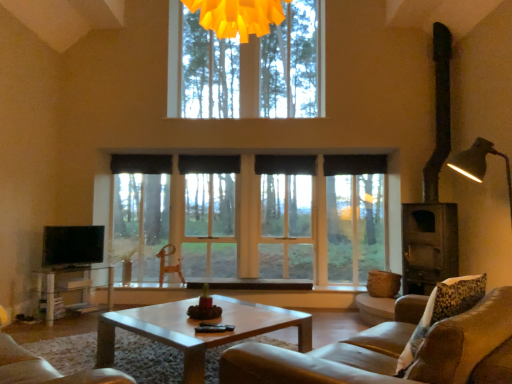
In order to face clear glass window at center, should I rotate leftwards or rightwards?

Turn left approximately 1.294 degrees to face it.

What do you see at coordinates (209, 164) in the screenshot? This screenshot has width=512, height=384. I see `black fabric curtain at center, arranged as the 3th curtain when viewed from the right` at bounding box center [209, 164].

The height and width of the screenshot is (384, 512). Describe the element at coordinates (285, 164) in the screenshot. I see `black fabric curtain at center, the third curtain positioned from the left` at that location.

The image size is (512, 384). Identify the location of dark brown wood stove at right. (433, 194).

I want to click on wooden armchair at center, so click(168, 265).

From the image's perspective, is brown leather couch at center under black fabric curtain at center, the 4th curtain in the left-to-right sequence?

Indeed, from the image's perspective, brown leather couch at center is shown beneath black fabric curtain at center, the 4th curtain in the left-to-right sequence.

Consider the image. Is brown leather couch at center inside or outside of black fabric curtain at center, which is the 1th curtain from right to left?

The correct answer is: outside.

At what (x,y) coordinates should I click in order to perform the action: click on curtain that is the 1st one when counting upward from the brown leather couch at center (from the image's perspective). Please return your answer as a coordinate pair (x, y). The image size is (512, 384). Looking at the image, I should click on (354, 164).

Considering the relative positions of black fabric curtain at center, positioned as the fourth curtain in right-to-left order, and dark brown wood stove at right in the image provided, is black fabric curtain at center, positioned as the fourth curtain in right-to-left order, to the right of dark brown wood stove at right from the viewer's perspective?

Incorrect, black fabric curtain at center, positioned as the fourth curtain in right-to-left order, is not on the right side of dark brown wood stove at right.

Looking at the image, does black fabric curtain at center, positioned as the fourth curtain in right-to-left order, seem bigger or smaller compared to dark brown wood stove at right?

black fabric curtain at center, positioned as the fourth curtain in right-to-left order, is smaller than dark brown wood stove at right.

Are black fabric curtain at center, positioned as the fourth curtain in right-to-left order, and dark brown wood stove at right beside each other?

black fabric curtain at center, positioned as the fourth curtain in right-to-left order, is not next to dark brown wood stove at right, and they're not touching.

Consider the image. Is black fabric curtain at center, arranged as the first curtain when viewed from the left, wider or thinner than dark brown wood stove at right?

Considering their sizes, black fabric curtain at center, arranged as the first curtain when viewed from the left, looks slimmer than dark brown wood stove at right.

The height and width of the screenshot is (384, 512). What are the coordinates of `window directly beneath the black fabric curtain at center, arranged as the 3th curtain when viewed from the right (from a real-world perspective)` in the screenshot? It's located at (280, 224).

Does point (166, 183) come in front of point (215, 173)?

No, (166, 183) is further to viewer.

Is clear glass window at center directly adjacent to black fabric curtain at center, marked as the second curtain in a left-to-right arrangement?

clear glass window at center and black fabric curtain at center, marked as the second curtain in a left-to-right arrangement, are clearly separated.

Between fluffy beige pillow at right and clear glass window at center, which one has larger width?

Wider between the two is fluffy beige pillow at right.

Is fluffy beige pillow at right situated inside clear glass window at center or outside?

fluffy beige pillow at right is not enclosed by clear glass window at center.

Considering the sizes of objects clear glass entertainment center at lower left and flat screen tv at left in the image provided, who is thinner, clear glass entertainment center at lower left or flat screen tv at left?

flat screen tv at left.

From the image's perspective, which one is positioned lower, clear glass entertainment center at lower left or flat screen tv at left?

clear glass entertainment center at lower left appears lower in the image.

Is clear glass entertainment center at lower left further to camera compared to flat screen tv at left?

No, clear glass entertainment center at lower left is closer to the camera.

Which point is more forward, (59, 233) or (42, 260)?

The point (59, 233) is in front.

From the image's perspective, relative to black fabric curtain at center, which is the 1th curtain from right to left, is light brown wooden coffee table at center above or below?

light brown wooden coffee table at center is below black fabric curtain at center, which is the 1th curtain from right to left.

Is light brown wooden coffee table at center far from black fabric curtain at center, the 4th curtain in the left-to-right sequence?

That's right, there is a large distance between light brown wooden coffee table at center and black fabric curtain at center, the 4th curtain in the left-to-right sequence.

Is point (244, 327) more distant than point (325, 173)?

No, (244, 327) is in front of (325, 173).

Is flat screen tv at left facing towards black fabric curtain at center, marked as the second curtain in a left-to-right arrangement?

No, flat screen tv at left is not turned towards black fabric curtain at center, marked as the second curtain in a left-to-right arrangement.

Is flat screen tv at left not near black fabric curtain at center, arranged as the 3th curtain when viewed from the right?

That's right, there is a large distance between flat screen tv at left and black fabric curtain at center, arranged as the 3th curtain when viewed from the right.

Considering the positions of point (82, 250) and point (201, 161), is point (82, 250) closer or farther from the camera than point (201, 161)?

Point (82, 250).

At what (x,y) coordinates should I click in order to perform the action: click on studio couch directly beneath the black fabric curtain at center, the 4th curtain in the left-to-right sequence (from a real-world perspective). Please return your answer as a coordinate pair (x, y). Looking at the image, I should click on (392, 351).

Identify the location of the 4th curtain behind the dark brown wood stove at right. (141, 164).

Which object lies nearer to the anchor point black fabric curtain at center, the third curtain positioned from the left, black fabric curtain at center, arranged as the first curtain when viewed from the left, or clear glass window at center?

Based on the image, clear glass window at center appears to be nearer to black fabric curtain at center, the third curtain positioned from the left.

From the image, which object appears to be nearer to dark brown wood stove at right, light brown wooden coffee table at center or brown leather couch at center?

Among the two, light brown wooden coffee table at center is located nearer to dark brown wood stove at right.

From the image, which object appears to be farther from clear glass window at center, black fabric curtain at center, positioned as the fourth curtain in right-to-left order, or light brown wooden coffee table at center?

Based on the image, light brown wooden coffee table at center appears to be further to clear glass window at center.

Based on their spatial positions, is black fabric curtain at center, the 4th curtain in the left-to-right sequence, or light brown wooden coffee table at center closer to fluffy beige pillow at right?

light brown wooden coffee table at center is positioned closer to the anchor fluffy beige pillow at right.

When comparing their distances from black fabric curtain at center, arranged as the 3th curtain when viewed from the right, does black fabric curtain at center, arranged as the first curtain when viewed from the left, or black fabric curtain at center, the second curtain viewed from the right, seem closer?

Based on the image, black fabric curtain at center, arranged as the first curtain when viewed from the left, appears to be nearer to black fabric curtain at center, arranged as the 3th curtain when viewed from the right.

In the scene shown: Looking at the image, which one is located further to black fabric curtain at center, the 4th curtain in the left-to-right sequence, wooden armchair at center or brown leather couch at center?

brown leather couch at center lies further to black fabric curtain at center, the 4th curtain in the left-to-right sequence, than the other object.

Considering their positions, is light brown wooden coffee table at center positioned further to fluffy beige pillow at right than black fabric curtain at center, marked as the second curtain in a left-to-right arrangement?

black fabric curtain at center, marked as the second curtain in a left-to-right arrangement, is further to fluffy beige pillow at right.

Looking at the image, which one is located further to light brown wooden coffee table at center, black fabric curtain at center, the 4th curtain in the left-to-right sequence, or black fabric curtain at center, arranged as the first curtain when viewed from the left?

Based on the image, black fabric curtain at center, arranged as the first curtain when viewed from the left, appears to be further to light brown wooden coffee table at center.

Image resolution: width=512 pixels, height=384 pixels. Find the location of `level situated between clear glass entertainment center at lower left and fluffy beige pillow at right from left to right`. level situated between clear glass entertainment center at lower left and fluffy beige pillow at right from left to right is located at coordinates (72, 245).

This screenshot has height=384, width=512. Identify the location of studio couch between flat screen tv at left and dark brown wood stove at right in the horizontal direction. (392, 351).

This screenshot has width=512, height=384. I want to click on entertainment center between brown leather couch at center and black fabric curtain at center, the 4th curtain in the left-to-right sequence, in the front-back direction, so click(72, 258).

Identify the location of armchair between black fabric curtain at center, positioned as the fourth curtain in right-to-left order, and clear glass entertainment center at lower left from top to bottom. This screenshot has width=512, height=384. (168, 265).